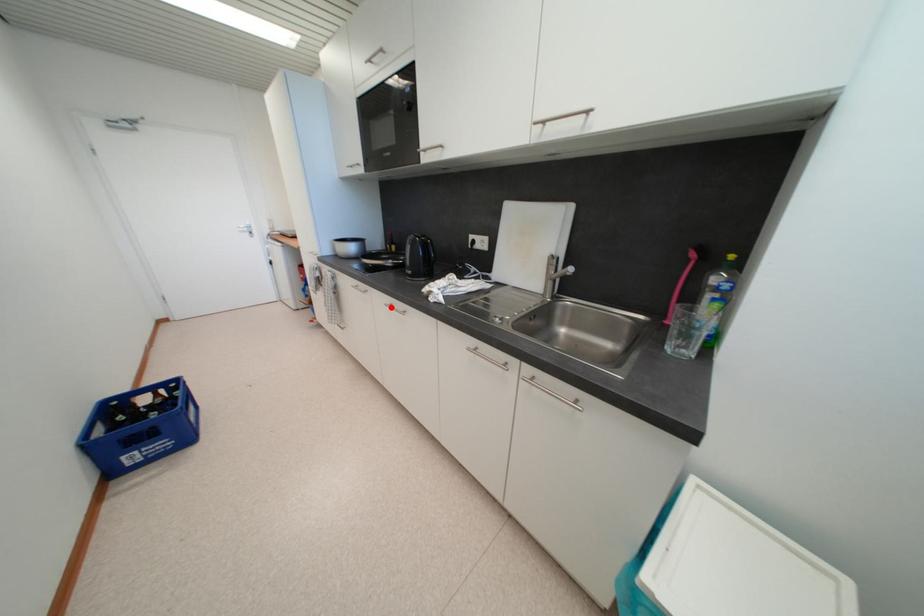
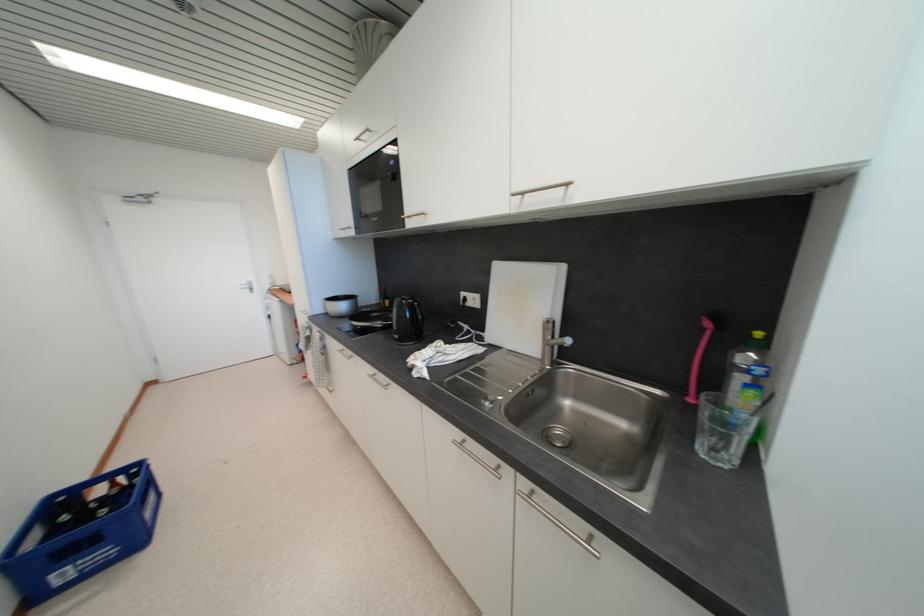
In the second image, find the point that corresponds to the highlighted location in the first image.

(373, 378)